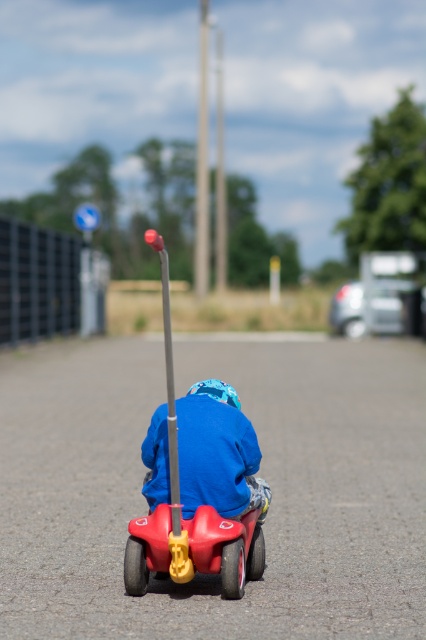
You are a parent trying to ensure your child stays safe while riding their tricycle on the paved road. You notice a rubberized plastic toy car at center in the image. Based on its position, would you consider this toy car a potential obstacle for the child? Please explain your reasoning.

The rubberized plastic toy car at center is located at point coordinates of (198,483). Since the child is riding a tricycle on the paved road and the toy car is positioned centrally in the image, it is likely in the path of the tricycle. This makes it a potential obstacle that the child might collide with while riding, so the parent should move it to a safer location.

You are standing behind the child on the red tricycle and want to place a small flag at one of two points in the image. The points are labeled as point 1 at coordinates (155, 554) and point 2 at coordinates (226, 480). Which point is closer to you?

Point 1 at coordinates (155, 554) is closer to the viewer than point 2 at coordinates (226, 480).